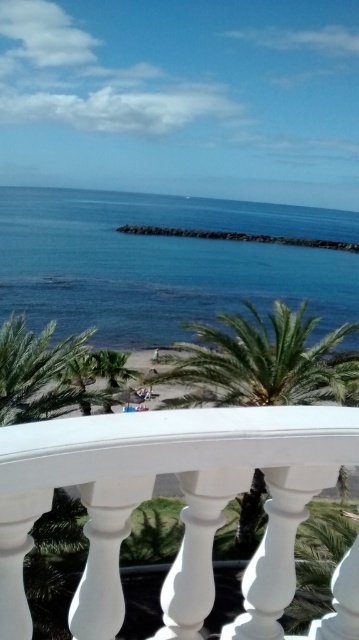
You are standing on the balcony and looking out at the coastal scene. You notice two points marked in the image. Which point, point [26,500] or point [348,392], is closer to you on the balcony?

Point [26,500] is closer to you on the balcony because it is in front of point [348,392].

Based on the photo, you are standing on the balcony and want to compare the sizes of the blue water at center and the green leafy palm tree at center. Which one appears wider from your viewpoint?

The blue water at center appears wider than the green leafy palm tree at center because its width is larger according to the description.

You are standing on the balcony and looking out at the scene. Which object, the blue water at center or the green leafy palm tree at center, appears closer to you based on their positions?

The blue water at center appears closer to you because it is positioned above the green leafy palm tree at center, which is further away.